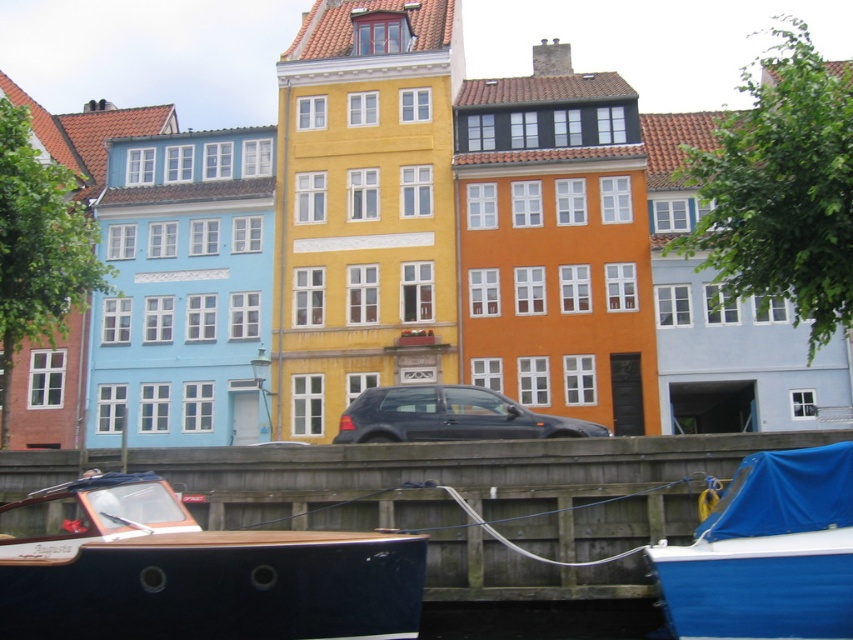
Question: Is dark blue polished wood boat at lower left behind satin black car at center?

Choices:
 (A) yes
 (B) no

Answer: (B)

Question: Where is wooden dock at lower center located in relation to satin black car at center in the image?

Choices:
 (A) above
 (B) below

Answer: (B)

Question: Which of the following is the farthest from the observer?

Choices:
 (A) (492, 404)
 (B) (699, 612)
 (C) (405, 579)
 (D) (457, 477)

Answer: (A)

Question: Which is farther from the wooden dock at lower center?

Choices:
 (A) blue fabric boat at lower right
 (B) dark blue polished wood boat at lower left
 (C) satin black car at center

Answer: (A)

Question: Which of these objects is positioned farthest from the wooden dock at lower center?

Choices:
 (A) blue fabric boat at lower right
 (B) dark blue polished wood boat at lower left

Answer: (A)

Question: From the image, what is the correct spatial relationship of wooden dock at lower center in relation to dark blue polished wood boat at lower left?

Choices:
 (A) right
 (B) left

Answer: (A)